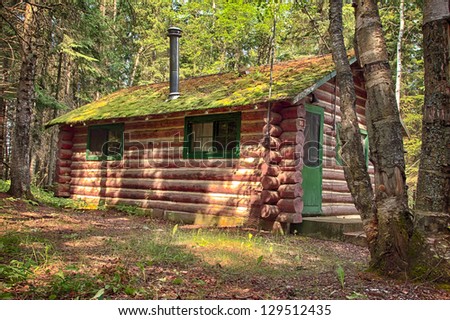
At what (x,y) coordinates should I click in order to perform the action: click on door. Please return your answer as a coordinate pair (x, y). The height and width of the screenshot is (320, 450). Looking at the image, I should click on (307, 177).